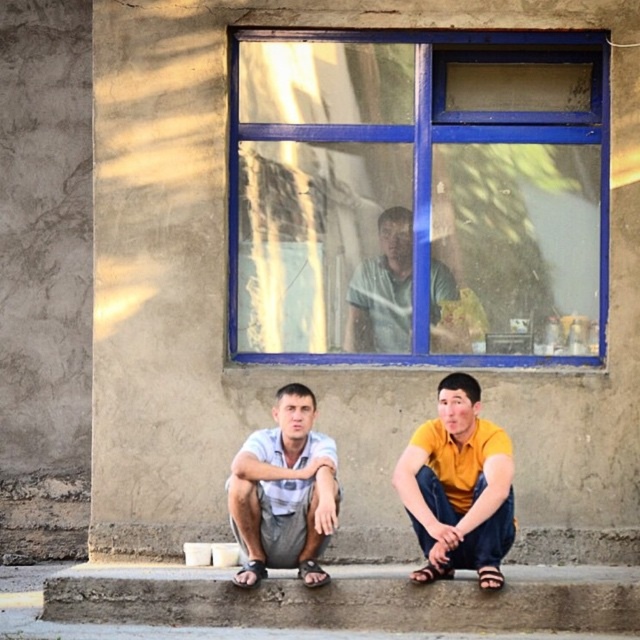
Where is `concrete at lower center`? This screenshot has width=640, height=640. concrete at lower center is located at coordinates (349, 600).

Between point (596, 586) and point (396, 276), which one is positioned behind?

Point (396, 276)

Where is `concrete at lower center`? concrete at lower center is located at coordinates pyautogui.click(x=349, y=600).

Does point (166, 609) lie behind point (292, 557)?

That is False.

What do you see at coordinates (349, 600) in the screenshot?
I see `concrete at lower center` at bounding box center [349, 600].

Where is `concrete at lower center`? This screenshot has height=640, width=640. concrete at lower center is located at coordinates (349, 600).

Who is positioned more to the left, blue painted glass window at upper center or concrete at lower center?

Positioned to the left is concrete at lower center.

Which is more to the right, blue painted glass window at upper center or concrete at lower center?

From the viewer's perspective, blue painted glass window at upper center appears more on the right side.

Between point (294, 166) and point (193, 588), which one is positioned behind?

The point (294, 166) is more distant.

Locate an element on the screen. This screenshot has height=640, width=640. blue painted glass window at upper center is located at coordinates 419,196.